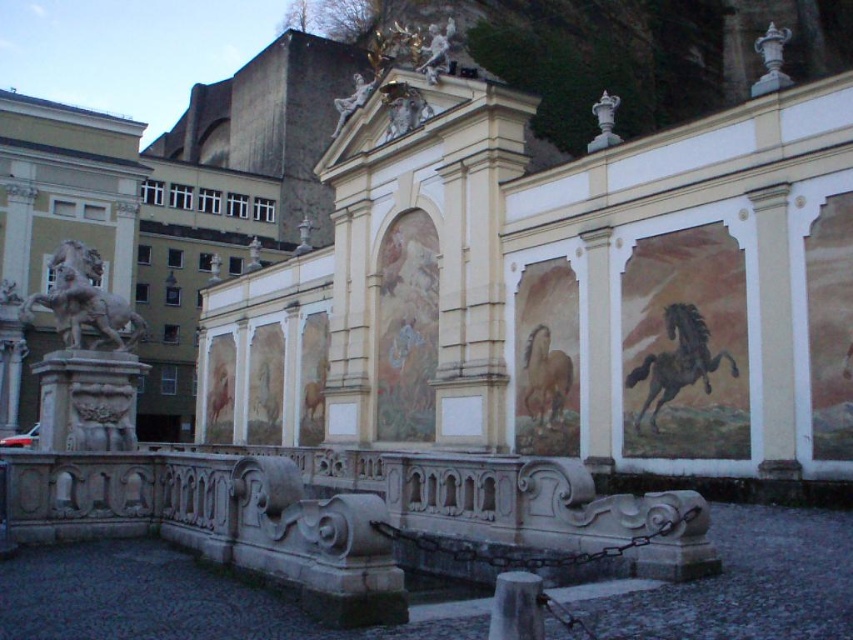
You are standing in front of the historical monument and want to take a photo. You notice two specific points marked on the structure. Which point, point (436, 36) or point (225, 372), is closer to your camera lens?

Point (436, 36) is closer to the camera than point (225, 372).

From the picture: You are an art student analyzing the historical monument. You notice the white marble horse at left and the white marble statue at upper center. Which of these two objects is positioned higher up on the monument?

The white marble statue at upper center is positioned higher up on the monument than the white marble horse at left.